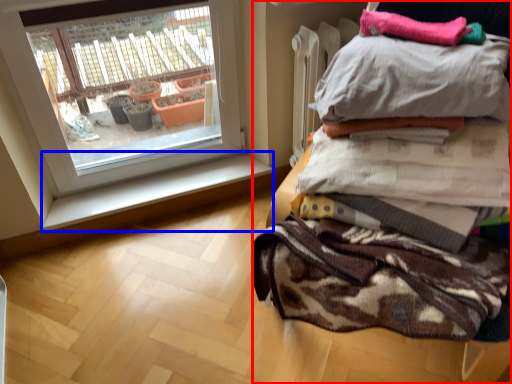
Question: Which object appears closest to the camera in this image, furniture (highlighted by a red box) or window sill (highlighted by a blue box)?

Choices:
 (A) furniture
 (B) window sill

Answer: (A)